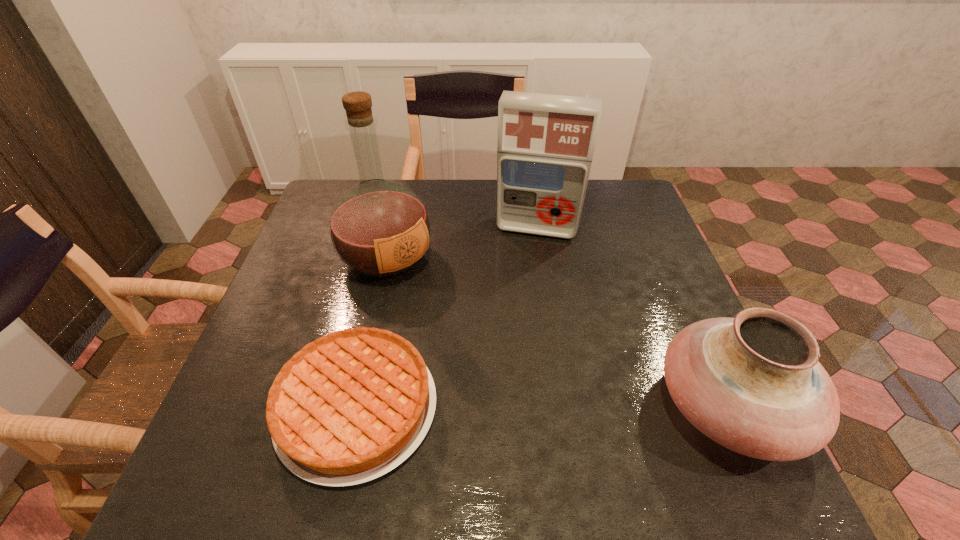
Find the location of a particular element. The height and width of the screenshot is (540, 960). pie is located at coordinates (349, 407).

Where is `pottery`? The height and width of the screenshot is (540, 960). pottery is located at coordinates (753, 383).

Where is `the third tallest object`? the third tallest object is located at coordinates click(753, 383).

Identify the location of liquor. (379, 228).

Find the location of a particular element. The width and height of the screenshot is (960, 540). the third shortest object is located at coordinates point(545,145).

You are a GUI agent. You are given a task and a screenshot of the screen. Output one action in this format:
    pyautogui.click(x=<x>, y=<y>)
    Task: Click on the first-aid kit
    This screenshot has width=960, height=540.
    Given the screenshot: What is the action you would take?
    pyautogui.click(x=545, y=145)

The width and height of the screenshot is (960, 540). What are the coordinates of `vacant space positioned 0.390m on the right of the shortest object` in the screenshot? It's located at (632, 408).

Where is `vacant space positioned 0.320m on the back of the third tallest object`? This screenshot has height=540, width=960. vacant space positioned 0.320m on the back of the third tallest object is located at coordinates (660, 254).

Locate an element on the screen. Image resolution: width=960 pixels, height=540 pixels. blank space located on the front label of the liquor is located at coordinates (452, 319).

You are a GUI agent. You are given a task and a screenshot of the screen. Output one action in this format:
    pyautogui.click(x=<x>, y=<y>)
    Task: Click on the free space located on the front label of the liquor
    
    Given the screenshot: What is the action you would take?
    pyautogui.click(x=429, y=298)